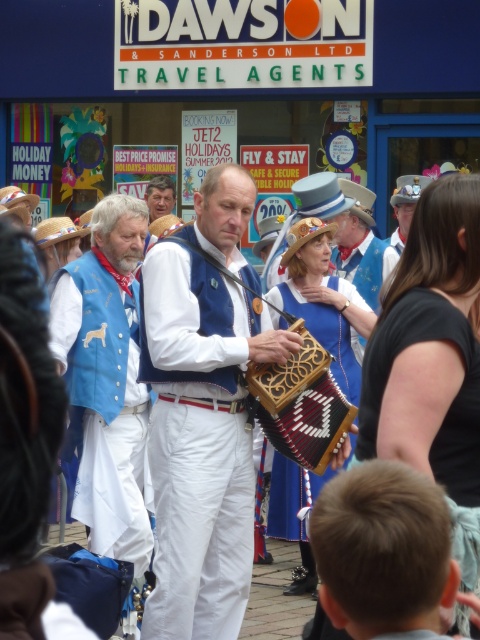
Does black fabric dress at center appear over wooden/carved accordion at center?

Correct, black fabric dress at center is located above wooden/carved accordion at center.

Is black fabric dress at center bigger than wooden/carved accordion at center?

Yes, black fabric dress at center is bigger than wooden/carved accordion at center.

Between point (462, 492) and point (312, 336), which one is positioned behind?

Positioned behind is point (312, 336).

Locate an element on the screen. This screenshot has width=480, height=640. black fabric dress at center is located at coordinates (424, 388).

Does black fabric dress at center have a smaller size compared to matte blue vest at upper right?

Actually, black fabric dress at center might be larger than matte blue vest at upper right.

Looking at this image, who is more forward, (457, 404) or (396, 248)?

Positioned in front is point (457, 404).

The image size is (480, 640). What do you see at coordinates (424, 388) in the screenshot?
I see `black fabric dress at center` at bounding box center [424, 388].

Where is `black fabric dress at center`? black fabric dress at center is located at coordinates (424, 388).

Who is more distant from viewer, (85, 371) or (296, 321)?

Point (85, 371)

Between point (130, 385) and point (323, 449), which one is positioned in front?

Point (323, 449)

In order to click on blue velvet vest at center in this screenshot , I will do `click(105, 406)`.